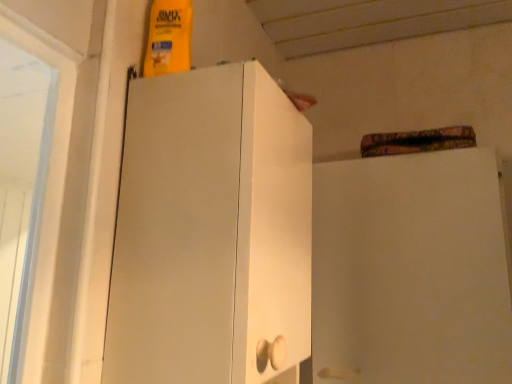
Question: Considering the relative sizes of white matte cabinet at left and white matte cabinet at upper right in the image provided, is white matte cabinet at left shorter than white matte cabinet at upper right?

Choices:
 (A) yes
 (B) no

Answer: (A)

Question: Does white matte cabinet at left have a lesser width compared to white matte cabinet at upper right?

Choices:
 (A) no
 (B) yes

Answer: (A)

Question: Is white matte cabinet at left facing towards white matte cabinet at upper right?

Choices:
 (A) no
 (B) yes

Answer: (A)

Question: Would you say white matte cabinet at left is outside white matte cabinet at upper right?

Choices:
 (A) yes
 (B) no

Answer: (A)

Question: Can you confirm if white matte cabinet at left is bigger than white matte cabinet at upper right?

Choices:
 (A) yes
 (B) no

Answer: (B)

Question: Is white matte cabinet at left facing away from white matte cabinet at upper right?

Choices:
 (A) yes
 (B) no

Answer: (B)

Question: From the image's perspective, would you say white matte cabinet at upper right is positioned over white matte cabinet at left?

Choices:
 (A) no
 (B) yes

Answer: (A)

Question: Would you say white matte cabinet at upper right is outside white matte cabinet at left?

Choices:
 (A) yes
 (B) no

Answer: (A)

Question: Would you say white matte cabinet at upper right contains white matte cabinet at left?

Choices:
 (A) yes
 (B) no

Answer: (B)

Question: From a real-world perspective, does white matte cabinet at upper right stand above white matte cabinet at left?

Choices:
 (A) no
 (B) yes

Answer: (A)

Question: Is white matte cabinet at upper right placed right next to white matte cabinet at left?

Choices:
 (A) yes
 (B) no

Answer: (B)

Question: Considering the relative positions of white matte cabinet at upper right and white matte cabinet at left in the image provided, is white matte cabinet at upper right to the right of white matte cabinet at left from the viewer's perspective?

Choices:
 (A) yes
 (B) no

Answer: (A)

Question: Considering the positions of white matte cabinet at upper right and white matte cabinet at left in the image, is white matte cabinet at upper right bigger or smaller than white matte cabinet at left?

Choices:
 (A) small
 (B) big

Answer: (B)